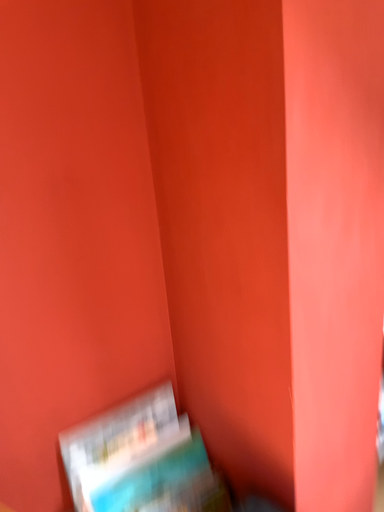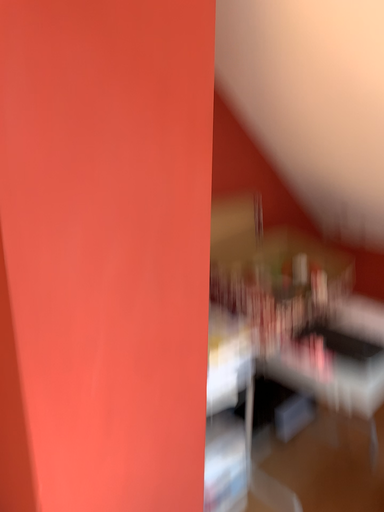
Question: How did the camera likely rotate when shooting the video?

Choices:
 (A) rotated left
 (B) rotated right

Answer: (B)